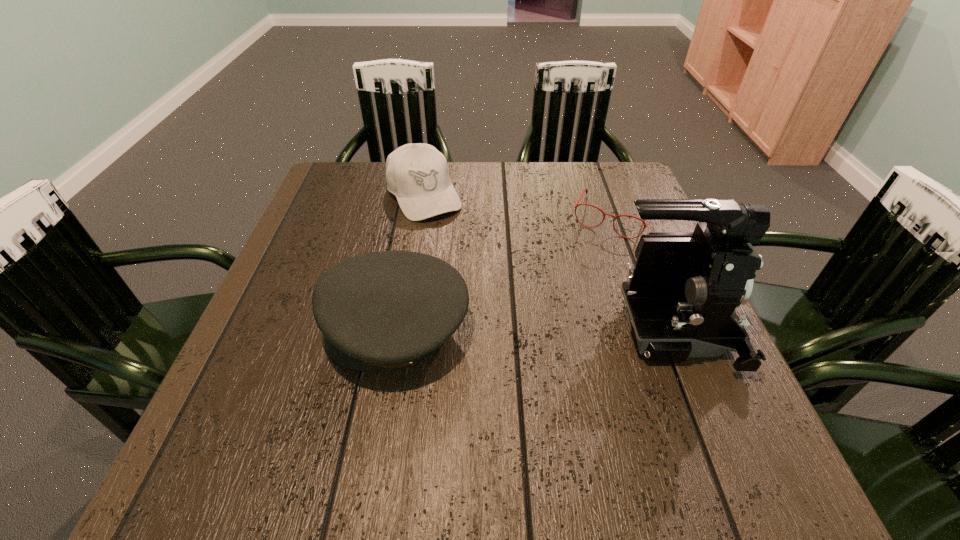
The width and height of the screenshot is (960, 540). I want to click on vacant region between the baseball cap and the shortest object, so click(x=518, y=206).

Where is `free space between the camcorder and the beret`? free space between the camcorder and the beret is located at coordinates (531, 331).

You are a GUI agent. You are given a task and a screenshot of the screen. Output one action in this format:
    pyautogui.click(x=<x>, y=<y>)
    Task: Click on the vacant region between the beret and the shortest object
    This screenshot has height=540, width=960.
    Given the screenshot: What is the action you would take?
    pyautogui.click(x=504, y=273)

Find the location of a particular element. This screenshot has height=540, width=960. the third closest object to the beret is located at coordinates (645, 225).

Point out which object is positioned as the nearest to the baseball cap. Please provide its 2D coordinates. Your answer should be formatted as a tuple, i.e. [(x, y)], where the tuple contains the x and y coordinates of a point satisfying the conditions above.

[(381, 310)]

You are a GUI agent. You are given a task and a screenshot of the screen. Output one action in this format:
    pyautogui.click(x=<x>, y=<y>)
    Task: Click on the free space that satisfies the following two spatial constraints: 1. on the front side of the baseball cap; 2. on the lens mount of the camcorder
    This screenshot has width=960, height=540.
    Given the screenshot: What is the action you would take?
    pyautogui.click(x=402, y=333)

In order to click on free spot that satisfies the following two spatial constraints: 1. on the front side of the camcorder; 2. on the lens mount of the baseball cap in this screenshot , I will do pos(402,333).

The height and width of the screenshot is (540, 960). Find the location of `vacant space that satisfies the following two spatial constraints: 1. on the front side of the tallest object; 2. on the lens mount of the baseball cap`. vacant space that satisfies the following two spatial constraints: 1. on the front side of the tallest object; 2. on the lens mount of the baseball cap is located at coordinates (402, 333).